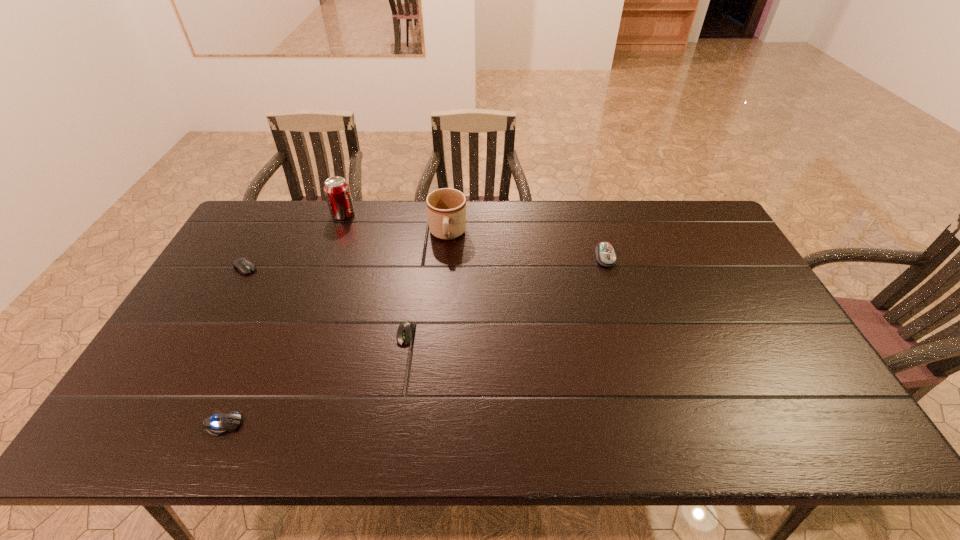
This screenshot has height=540, width=960. I want to click on free area in between the fourth shortest object and the nearest computer mouse, so click(414, 341).

Locate an element on the screen. This screenshot has width=960, height=540. empty space between the leftmost object and the mug is located at coordinates (347, 251).

At what (x,y) coordinates should I click in order to perform the action: click on free spot between the nearest computer mouse and the tallest computer mouse. Please return your answer as a coordinate pair (x, y). The image size is (960, 540). Looking at the image, I should click on (414, 341).

Where is `object that is the third nearest to the rightmost object`? The image size is (960, 540). object that is the third nearest to the rightmost object is located at coordinates (337, 191).

Choose which object is the nearest neighbor to the tallest computer mouse. Please provide its 2D coordinates. Your answer should be formatted as a tuple, i.e. [(x, y)], where the tuple contains the x and y coordinates of a point satisfying the conditions above.

[(446, 208)]

Locate an element on the screen. The image size is (960, 540). computer mouse that can be found as the fourth closest to the second object from right to left is located at coordinates (220, 423).

I want to click on computer mouse that is the closest one to the third computer mouse from left to right, so click(x=220, y=423).

In order to click on vacant space that satisfies the following two spatial constraints: 1. on the side of the mug with the handle; 2. on the button side of the second computer mouse from left to right in this screenshot , I will do (432, 424).

Find the location of a particular element. free space that satisfies the following two spatial constraints: 1. on the side of the second object from right to left with the handle; 2. on the button side of the nearest object is located at coordinates (432, 424).

Locate an element on the screen. free spot that satisfies the following two spatial constraints: 1. on the back side of the leftmost computer mouse; 2. on the right side of the soda can is located at coordinates (275, 214).